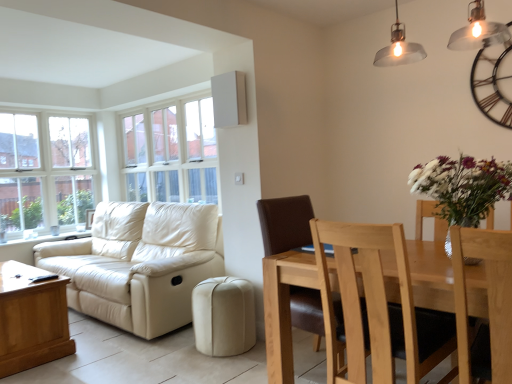
At what (x,y) coordinates should I click in order to perform the action: click on vacant space in front of beige leather ottoman at lower center. Please return your answer as a coordinate pair (x, y). The image size is (512, 384). Looking at the image, I should click on (193, 370).